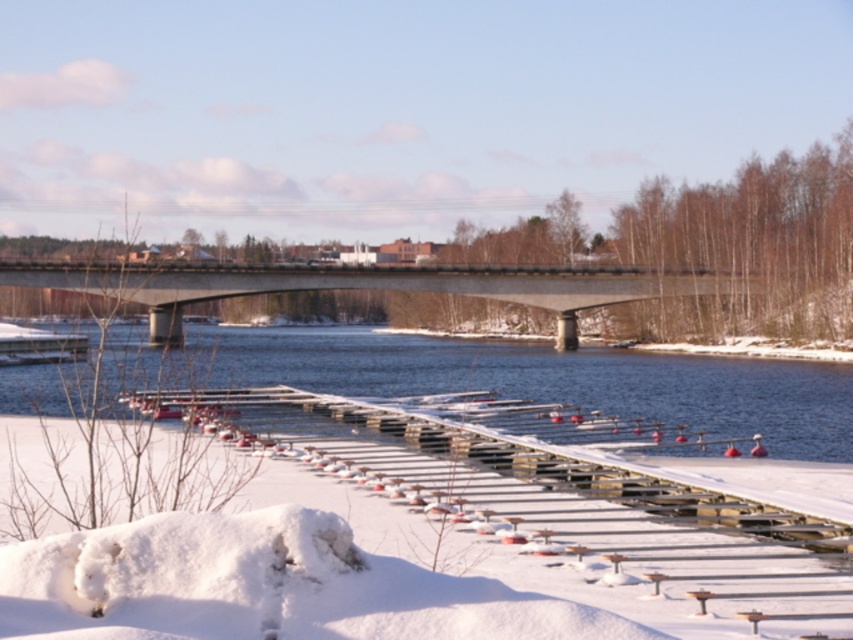
You are a photographer planning to capture the entire scene in one shot. Given that the blue water at center and the concrete bridge at center are both in the frame, which object will occupy a larger portion of the photo?

The concrete bridge at center occupies a larger portion of the photo because it is bigger than the blue water at center.

You are a delivery drone that needs to pass through the gap between the blue water at center and the concrete bridge at center. The drone has a width of 1.2 meters. Can you safely navigate through the gap?

The blue water at center has a width less than the concrete bridge at center. Since the drone is 1.2 meters wide, it cannot safely navigate through the gap as the water is narrower than the bridge, but the exact width isn